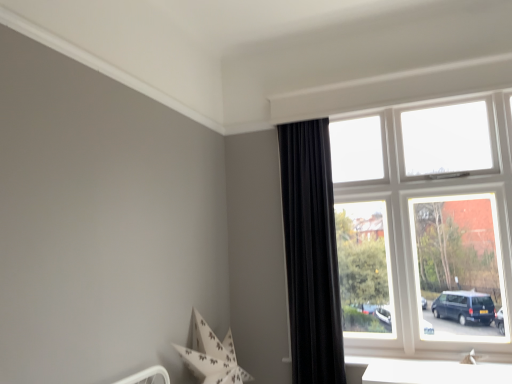
What do you see at coordinates (425, 227) in the screenshot?
I see `white frame window at upper right` at bounding box center [425, 227].

Locate an element on the screen. white frame window at upper right is located at coordinates (425, 227).

This screenshot has height=384, width=512. What do you see at coordinates (311, 253) in the screenshot? I see `black velvet curtain at right` at bounding box center [311, 253].

Where is `black velvet curtain at right`? The height and width of the screenshot is (384, 512). black velvet curtain at right is located at coordinates (311, 253).

This screenshot has width=512, height=384. I want to click on white frame window at upper right, so click(425, 227).

Between black velvet curtain at right and white frame window at upper right, which one appears on the left side from the viewer's perspective?

black velvet curtain at right.

Does black velvet curtain at right lie in front of white frame window at upper right?

That is False.

Is point (305, 324) closer or farther from the camera than point (409, 267)?

Clearly, point (305, 324) is closer to the camera than point (409, 267).

From the image's perspective, is black velvet curtain at right located above white frame window at upper right?

No, from the image's perspective, black velvet curtain at right is not over white frame window at upper right.

From a real-world perspective, is black velvet curtain at right positioned over white frame window at upper right based on gravity?

No, from a real-world perspective, black velvet curtain at right is not on top of white frame window at upper right.

Looking at this image, considering the sizes of objects black velvet curtain at right and white frame window at upper right in the image provided, who is thinner, black velvet curtain at right or white frame window at upper right?

With smaller width is white frame window at upper right.

Is black velvet curtain at right shorter than white frame window at upper right?

No, black velvet curtain at right is not shorter than white frame window at upper right.

Which of these two, black velvet curtain at right or white frame window at upper right, is bigger?

With larger size is white frame window at upper right.

Which is correct: black velvet curtain at right is inside white frame window at upper right, or outside of it?

black velvet curtain at right lies outside white frame window at upper right.

Is black velvet curtain at right beside white frame window at upper right?

No.

Based on the photo, does black velvet curtain at right turn towards white frame window at upper right?

No.

Where is `curtain on the left of white frame window at upper right`? This screenshot has width=512, height=384. curtain on the left of white frame window at upper right is located at coordinates (311, 253).

Is white frame window at upper right at the right side of black velvet curtain at right?

Indeed, white frame window at upper right is positioned on the right side of black velvet curtain at right.

Is white frame window at upper right further to the viewer compared to black velvet curtain at right?

No, it is in front of black velvet curtain at right.

Which is closer to the camera, (371, 241) or (302, 218)?

Positioned in front is point (302, 218).

From the image's perspective, which one is positioned lower, white frame window at upper right or black velvet curtain at right?

black velvet curtain at right.

In the scene shown: From a real-world perspective, which object rests below the other?

In real-world perspective, black velvet curtain at right is lower.

Considering the sizes of objects white frame window at upper right and black velvet curtain at right in the image provided, who is thinner, white frame window at upper right or black velvet curtain at right?

Thinner between the two is white frame window at upper right.

From their relative heights in the image, would you say white frame window at upper right is taller or shorter than black velvet curtain at right?

white frame window at upper right is shorter than black velvet curtain at right.

Between white frame window at upper right and black velvet curtain at right, which one has smaller size?

black velvet curtain at right.

Would you say white frame window at upper right contains black velvet curtain at right?

Definitely not — black velvet curtain at right is not inside white frame window at upper right.

Is white frame window at upper right far from black velvet curtain at right?

No, there isn't a large distance between white frame window at upper right and black velvet curtain at right.

Is white frame window at upper right turned away from black velvet curtain at right?

No, white frame window at upper right is not facing the opposite direction of black velvet curtain at right.

How distant is white frame window at upper right from black velvet curtain at right?

21.60 inches.

This screenshot has width=512, height=384. What are the coordinates of `window located above the black velvet curtain at right (from a real-world perspective)` in the screenshot? It's located at (425, 227).

Locate an element on the screen. The image size is (512, 384). window in front of the black velvet curtain at right is located at coordinates (425, 227).

Find the location of `curtain located underneath the white frame window at upper right (from a real-world perspective)`. curtain located underneath the white frame window at upper right (from a real-world perspective) is located at coordinates (311, 253).